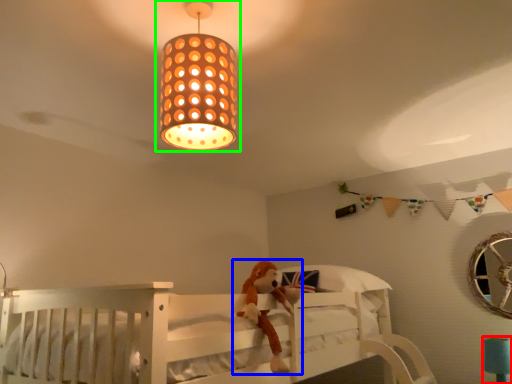
Question: Based on their relative distances, which object is nearer to table lamp (highlighted by a red box)? Choose from toy (highlighted by a blue box) and lamp (highlighted by a green box).

Choices:
 (A) toy
 (B) lamp

Answer: (A)